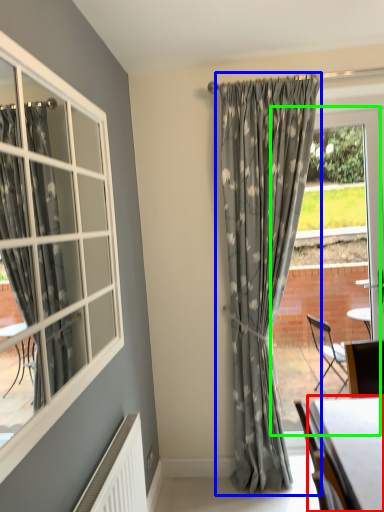
Question: Based on their relative distances, which object is nearer to table (highlighted by a red box)? Choose from curtain (highlighted by a blue box) and window frame (highlighted by a green box).

Choices:
 (A) curtain
 (B) window frame

Answer: (A)